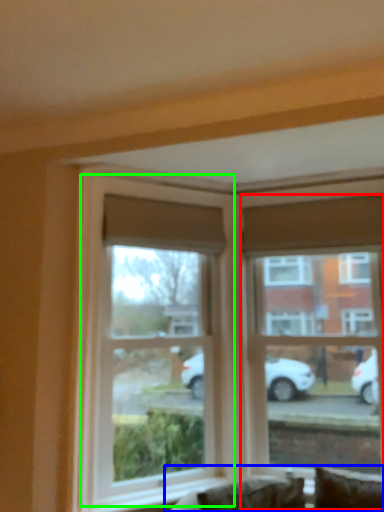
Question: Considering the real-world distances, which object is farthest from window (highlighted by a red box)? couch (highlighted by a blue box) or window (highlighted by a green box)?

Choices:
 (A) couch
 (B) window

Answer: (A)